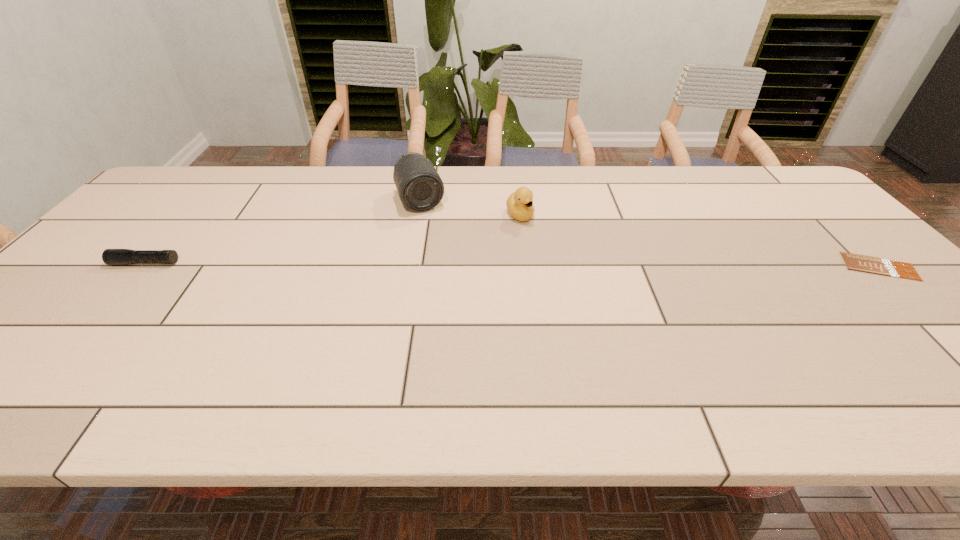
Where is `the third tallest object`? Image resolution: width=960 pixels, height=540 pixels. the third tallest object is located at coordinates (109, 256).

Find the location of `flashlight`. flashlight is located at coordinates (109, 256).

In order to click on the rightmost object in this screenshot , I will do `click(868, 264)`.

This screenshot has width=960, height=540. In order to click on chocolate bar in this screenshot , I will do `click(868, 264)`.

Find the location of a particular element. This screenshot has width=960, height=540. the second object from left to right is located at coordinates 420,188.

Find the location of a particular element. telephoto lens is located at coordinates (420, 188).

The image size is (960, 540). I want to click on the third object from left to right, so click(519, 204).

Identify the location of the second tallest object. (519, 204).

You are a GUI agent. You are given a task and a screenshot of the screen. Output one action in this format:
    pyautogui.click(x=<x>, y=<y>)
    Task: Click on the free space located 0.060m at the lens end of the leftmost object
    The height and width of the screenshot is (540, 960).
    Given the screenshot: What is the action you would take?
    90,263

You are a GUI agent. You are given a task and a screenshot of the screen. Output one action in this format:
    pyautogui.click(x=<x>, y=<y>)
    Task: Click on the vacant space situated 0.220m on the left of the rightmost object
    
    Given the screenshot: What is the action you would take?
    pyautogui.click(x=759, y=267)